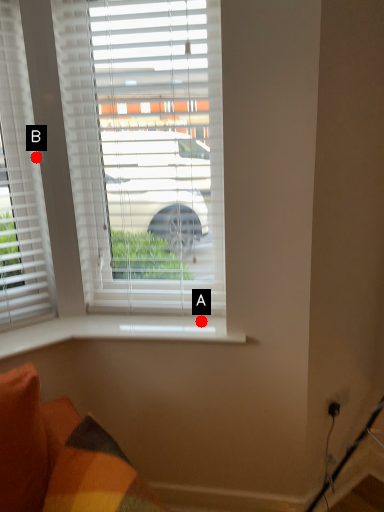
Question: Two points are circled on the image, labeled by A and B beside each circle. Which point is closer to the camera?

Choices:
 (A) A is closer
 (B) B is closer

Answer: (B)